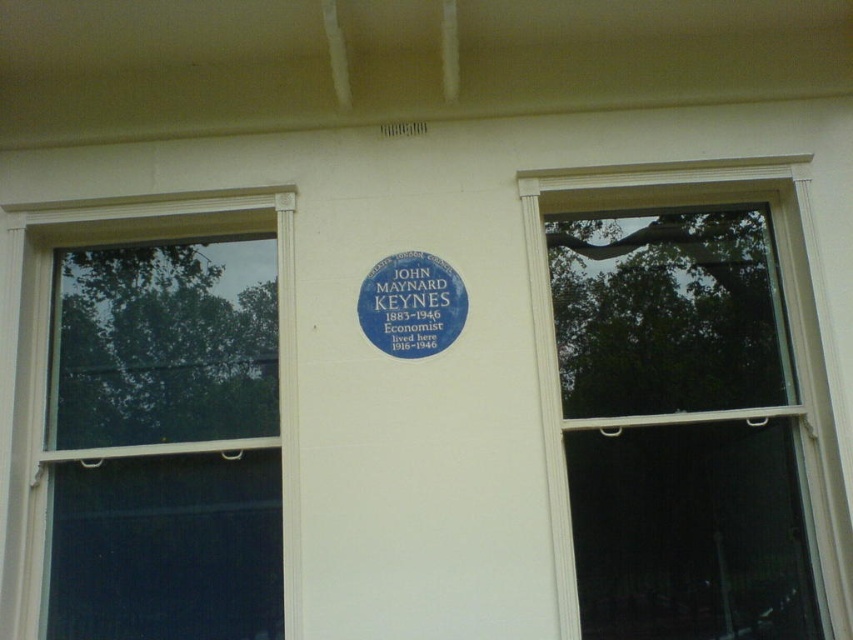
You are standing in front of the building and want to touch the plaque between the two windows. The plaque is at the center between the two windows. If you reach out your hand to touch the plaque, will your hand pass through the transparent glass window at upper right represented by point (791,330)?

The transparent glass window at upper right represented by point (791,330) is part of the window structure. Since the plaque is located in the center between the two windows, your hand would not pass through the transparent glass window at upper right represented by point (791,330) when reaching for the plaque.